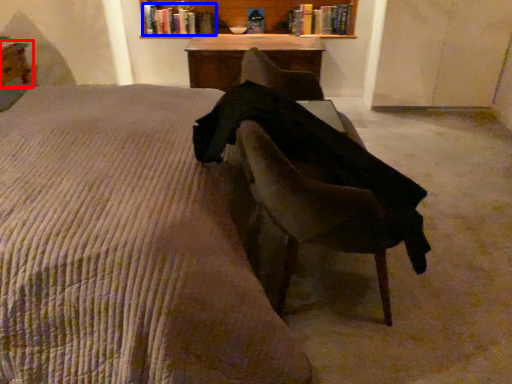
Question: Which point is closer to the camera, table (highlighted by a red box) or book (highlighted by a blue box)?

Choices:
 (A) table
 (B) book

Answer: (A)